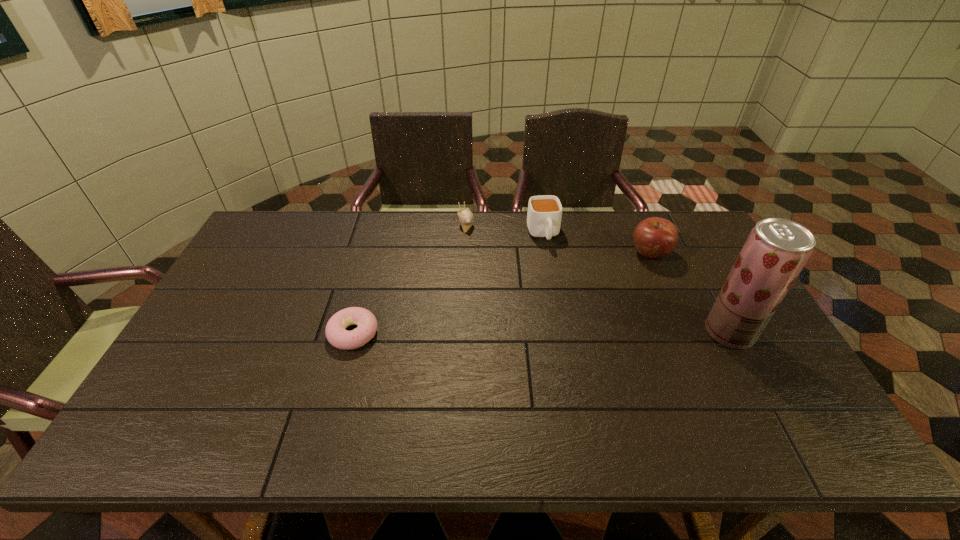
This screenshot has width=960, height=540. I want to click on free space between the second shortest object and the apple, so click(558, 237).

You are a GUI agent. You are given a task and a screenshot of the screen. Output one action in this format:
    pyautogui.click(x=<x>, y=<y>)
    Task: Click on the vacant space in between the escargot and the fruit juice
    
    Given the screenshot: What is the action you would take?
    pyautogui.click(x=597, y=277)

Find the location of a particular element. The height and width of the screenshot is (540, 960). empty location between the apple and the shortest object is located at coordinates (x=502, y=293).

Where is `free space that is in between the apple and the cup`? This screenshot has width=960, height=540. free space that is in between the apple and the cup is located at coordinates (597, 244).

Locate an element on the screen. blank region between the shortest object and the escargot is located at coordinates 409,278.

This screenshot has width=960, height=540. I want to click on free spot between the fourth object from right to left and the third object from left to right, so click(x=504, y=228).

What are the coordinates of `vacant region between the tallest object and the third object from right to left` in the screenshot? It's located at (636, 284).

Identify the location of free area in between the shortest object and the apple. (502, 293).

Locate an element on the screen. The height and width of the screenshot is (540, 960). free area in between the apple and the fruit juice is located at coordinates (690, 293).

Locate an element on the screen. object that is the closest to the second shortest object is located at coordinates (544, 215).